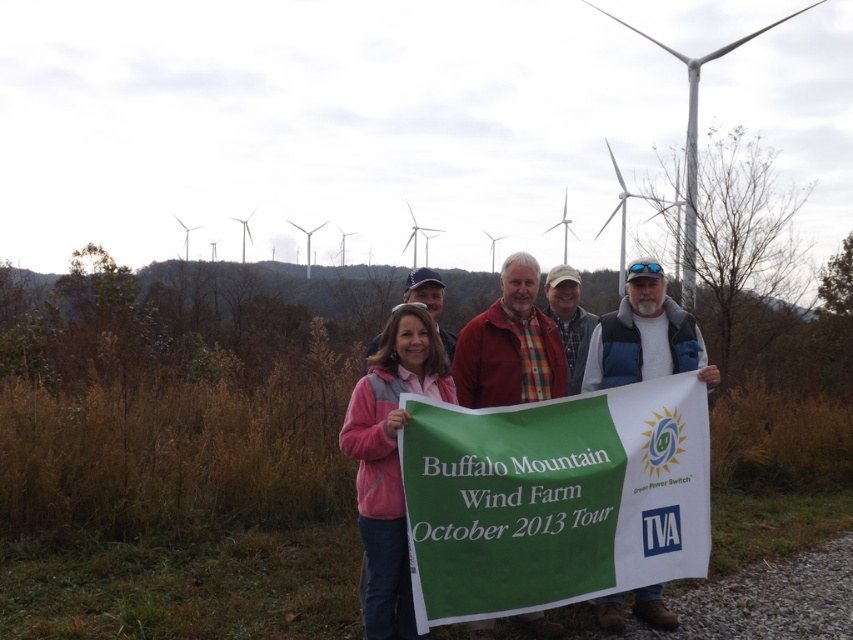
Question: Which point is closer to the camera?

Choices:
 (A) white fleece jacket at center
 (B) pink fleece jacket at center
 (C) red plaid shirt at center
 (D) matte pink jacket at center

Answer: (B)

Question: Is pink fleece jacket at center behind white fleece jacket at center?

Choices:
 (A) no
 (B) yes

Answer: (A)

Question: Does pink fleece jacket at center appear on the right side of white fleece jacket at center?

Choices:
 (A) no
 (B) yes

Answer: (A)

Question: Among these points, which one is nearest to the camera?

Choices:
 (A) (386, 419)
 (B) (399, 506)

Answer: (A)

Question: In this image, where is matte pink jacket at center located relative to red plaid shirt at center?

Choices:
 (A) left
 (B) right

Answer: (A)

Question: Which of the following is the farthest from the observer?

Choices:
 (A) (402, 612)
 (B) (410, 292)

Answer: (B)